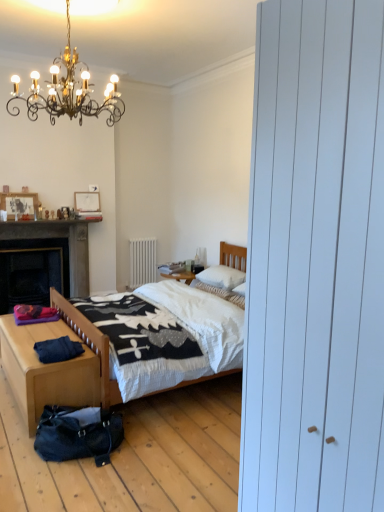
Question: Is wooden picture frame at upper left, the second picture frame in the right-to-left sequence, surrounding white matte radiator at center?

Choices:
 (A) yes
 (B) no

Answer: (B)

Question: Would you say wooden picture frame at upper left, which is the second picture frame in back-to-front order, is outside white matte radiator at center?

Choices:
 (A) no
 (B) yes

Answer: (B)

Question: Is wooden picture frame at upper left, the second picture frame in the right-to-left sequence, smaller than white matte radiator at center?

Choices:
 (A) yes
 (B) no

Answer: (A)

Question: From a real-world perspective, is wooden picture frame at upper left, which is the second picture frame in back-to-front order, located higher than white matte radiator at center?

Choices:
 (A) yes
 (B) no

Answer: (A)

Question: Is wooden picture frame at upper left, which is the second picture frame in back-to-front order, taller than white matte radiator at center?

Choices:
 (A) yes
 (B) no

Answer: (B)

Question: Is point (23, 245) positioned closer to the camera than point (208, 283)?

Choices:
 (A) farther
 (B) closer

Answer: (A)

Question: Visually, is wooden table at lower left positioned to the left or to the right of white soft pillow at center, which ranks as the 2th pillow in bottom-to-top order?

Choices:
 (A) right
 (B) left

Answer: (B)

Question: Considering the positions of wooden table at lower left and white soft pillow at center, which ranks as the 2th pillow in bottom-to-top order, in the image, is wooden table at lower left wider or thinner than white soft pillow at center, which ranks as the 2th pillow in bottom-to-top order,?

Choices:
 (A) thin
 (B) wide

Answer: (B)

Question: Considering their positions, is wooden table at lower left located in front of or behind white soft pillow at center, which ranks as the 2th pillow in bottom-to-top order?

Choices:
 (A) behind
 (B) front

Answer: (A)

Question: Is dark blue cotton pants at lower left inside the boundaries of light wood/texture nightstand at lower left, or outside?

Choices:
 (A) outside
 (B) inside

Answer: (A)

Question: Considering the positions of point (59, 346) and point (84, 391), is point (59, 346) closer or farther from the camera than point (84, 391)?

Choices:
 (A) closer
 (B) farther

Answer: (B)

Question: Looking at the image, does dark blue cotton pants at lower left seem bigger or smaller compared to light wood/texture nightstand at lower left?

Choices:
 (A) small
 (B) big

Answer: (A)

Question: Is dark blue cotton pants at lower left wider or thinner than light wood/texture nightstand at lower left?

Choices:
 (A) thin
 (B) wide

Answer: (A)

Question: Is white quilted bed at center wider or thinner than wooden picture frame at upper left, which appears as the first picture frame when viewed from the left?

Choices:
 (A) wide
 (B) thin

Answer: (A)

Question: Is white quilted bed at center taller or shorter than wooden picture frame at upper left, which is the second picture frame in back-to-front order?

Choices:
 (A) short
 (B) tall

Answer: (B)